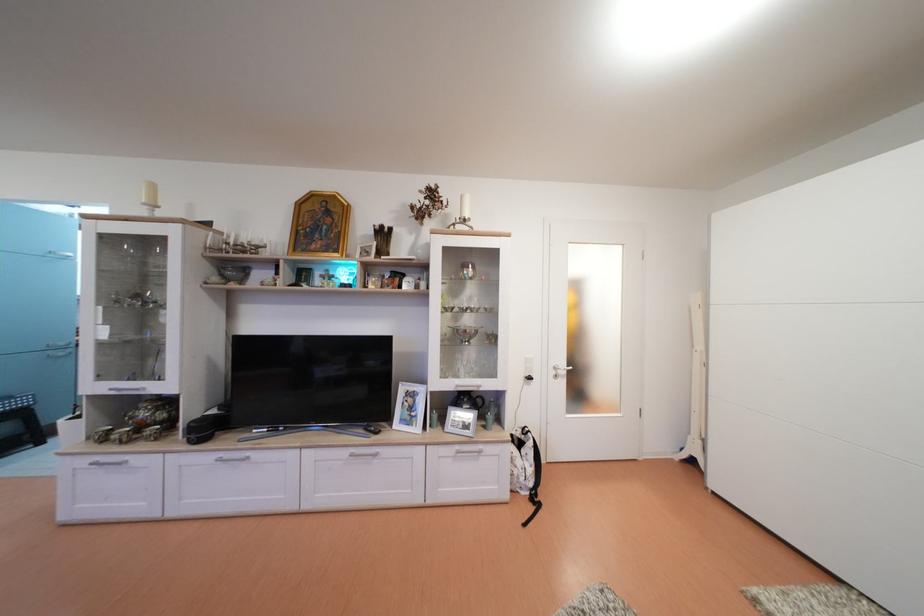
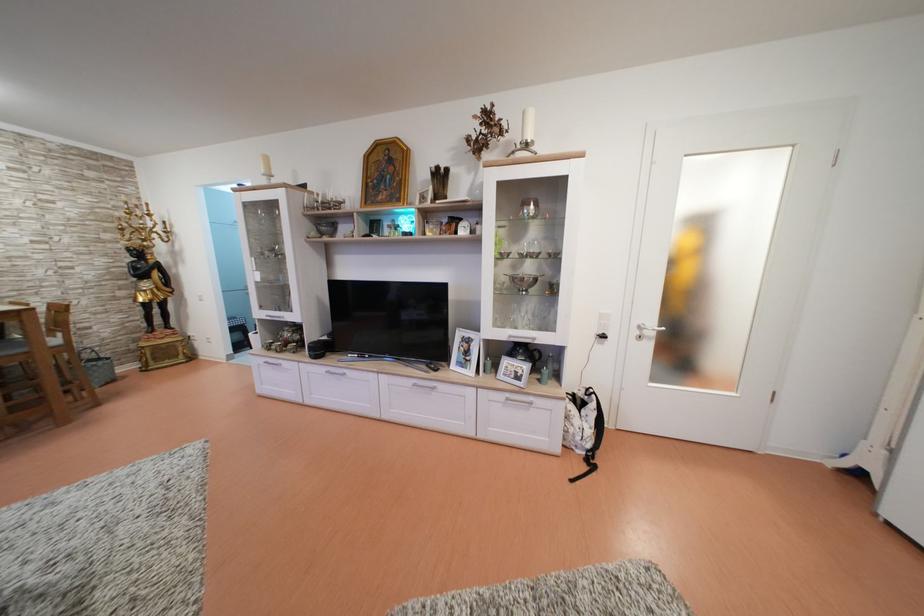
In the second image, find the point that corresponds to (228,460) in the first image.

(335, 374)